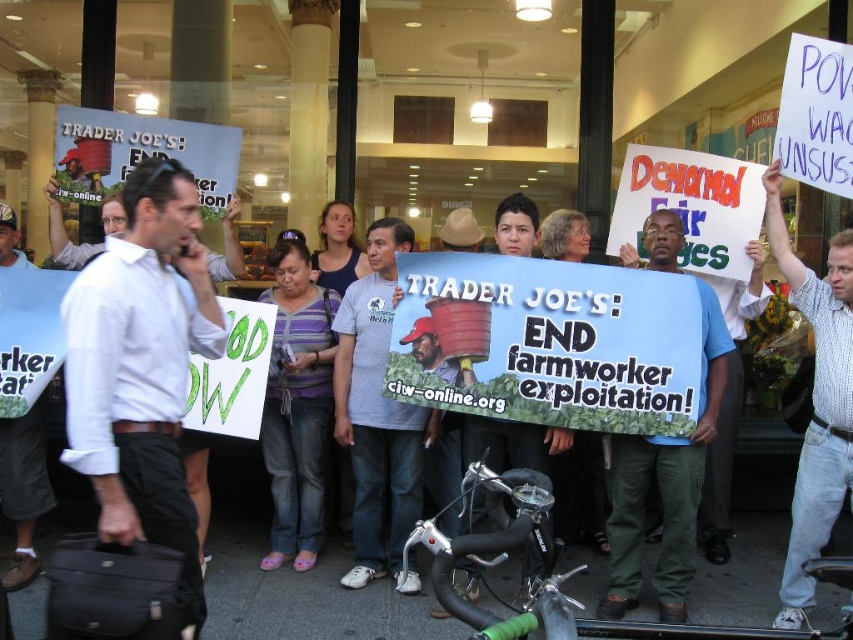
You are a photographer at the protest and want to capture both the white checkered shirt at upper right and the purple striped shirt at center in a single shot. Which shirt should you focus on to ensure both are in frame?

The white checkered shirt at upper right is taller than the purple striped shirt at center, so focusing on the taller shirt would ensure both are in frame.

You are a photographer standing at the edge of the protest. You want to take a photo that includes both the white checkered shirt at upper right and the purple striped shirt at center. Given that your camera has a maximum focus range of 2.5 meters, will you be able to capture both shirts in the same frame without moving closer?

The white checkered shirt at upper right is 2.83 meters from the purple striped shirt at center. Since the distance exceeds the camera maximum focus range of 2.5 meters, you will not be able to capture both shirts in the same frame without moving closer.